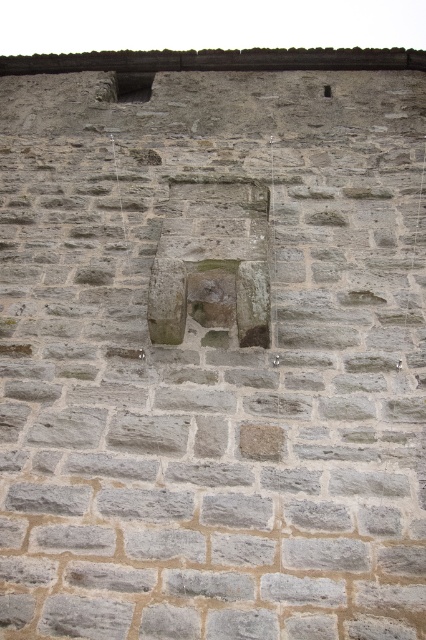
Is matte stone window at upper left bigger than gray stone hole at upper center?

Correct, matte stone window at upper left is larger in size than gray stone hole at upper center.

Describe the element at coordinates (134, 86) in the screenshot. I see `matte stone window at upper left` at that location.

The image size is (426, 640). I want to click on matte stone window at upper left, so click(134, 86).